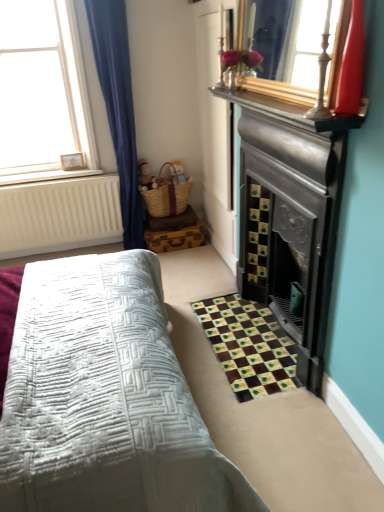
Where is `free space to the left of wooden picture frame at upper left`? Image resolution: width=384 pixels, height=512 pixels. free space to the left of wooden picture frame at upper left is located at coordinates (51, 174).